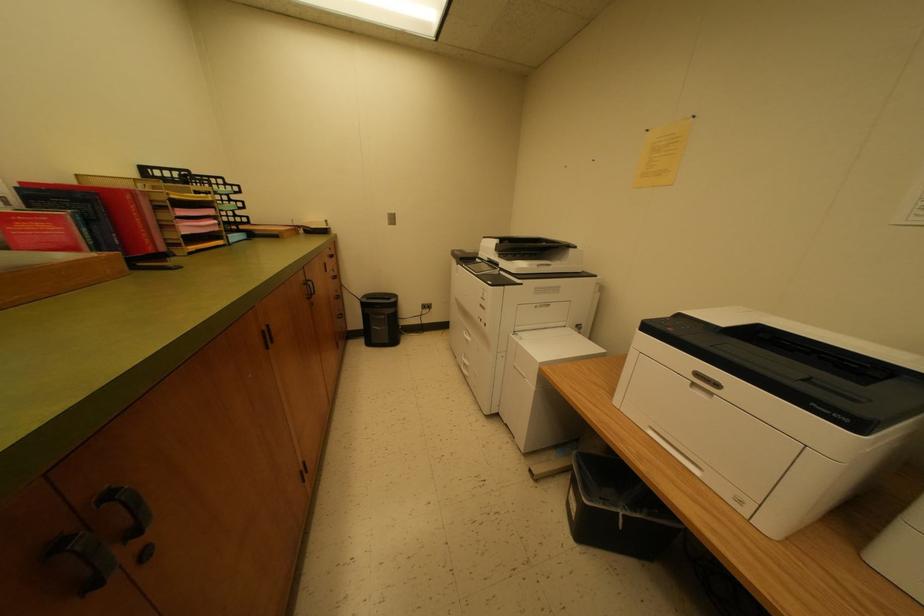
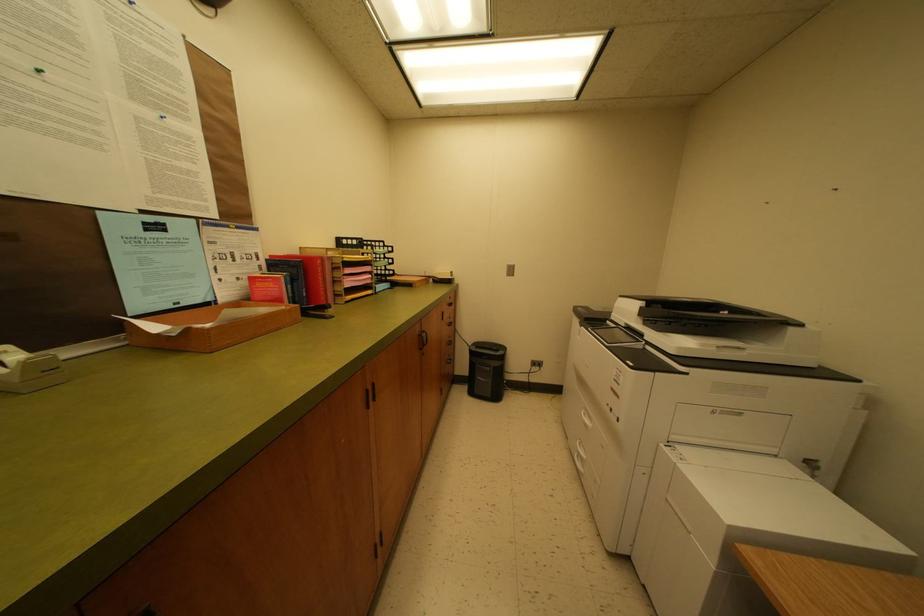
Question: Which direction would the cameraman need to move to produce the second image? Reply with the corresponding letter.

Choices:
 (A) Left
 (B) Right
 (C) Forward
 (D) Backward

Answer: (C)